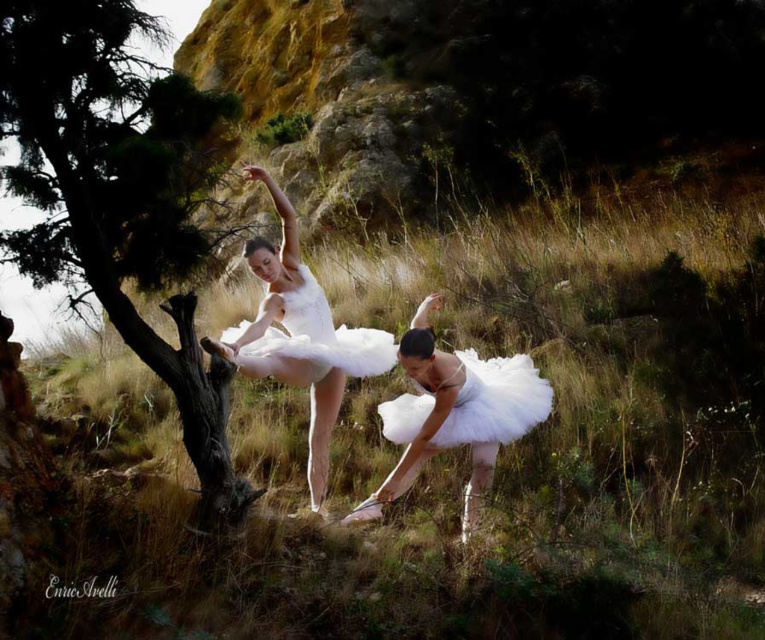
You are a photographer observing the two ballerinas in the scene. You notice both the white tulle tutu at center and the white satin tutu at center. Which tutu is closer to you?

The white tulle tutu at center is closer to you because it is positioned further to the viewer than the white satin tutu at center.

Based on the scene description, what object is located at the coordinates point (119, 195)?

The green textured tree at left is located at point (119, 195).

You are a photographer observing two dancers in an outdoor setting. You notice the white satin tutu at center and the white tulle dress at center. Which of these two items is positioned lower in the image?

The white satin tutu at center is positioned below the white tulle dress at center, so it is lower in the image.